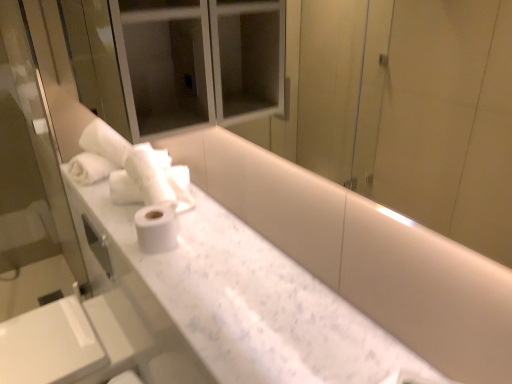
You are a GUI agent. You are given a task and a screenshot of the screen. Output one action in this format:
    pyautogui.click(x=<x>, y=<y>)
    Task: Click on the vacant area that lies to the right of white matte toilet paper at center
    This screenshot has width=512, height=384.
    Given the screenshot: What is the action you would take?
    coord(207,243)